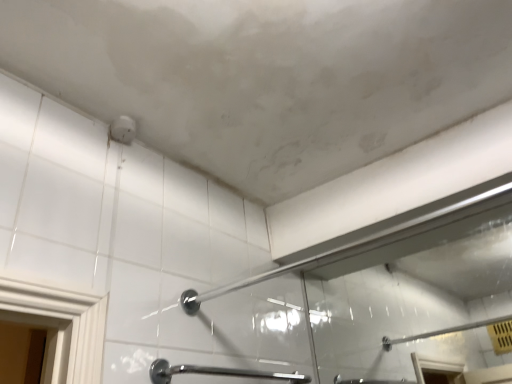
The width and height of the screenshot is (512, 384). I want to click on white glossy shower at center, so click(x=384, y=243).

The width and height of the screenshot is (512, 384). Describe the element at coordinates (384, 243) in the screenshot. I see `white glossy shower at center` at that location.

In order to face polished chrome grab bar at lower center, should I rotate leftwards or rightwards?

You should rotate left by 0.037 degrees.

Describe the element at coordinates (217, 373) in the screenshot. The width and height of the screenshot is (512, 384). I see `polished chrome grab bar at lower center` at that location.

Where is `polished chrome grab bar at lower center`? polished chrome grab bar at lower center is located at coordinates (217, 373).

Locate an element on the screen. The height and width of the screenshot is (384, 512). white glossy shower at center is located at coordinates (x=384, y=243).

Which object is positioned more to the left, white glossy shower at center or polished chrome grab bar at lower center?

Positioned to the left is polished chrome grab bar at lower center.

Which object is further away from the camera, white glossy shower at center or polished chrome grab bar at lower center?

polished chrome grab bar at lower center.

Considering the points (373, 243) and (157, 366), which point is behind, point (373, 243) or point (157, 366)?

The point (373, 243) is farther.

From the image's perspective, is white glossy shower at center on polished chrome grab bar at lower center?

Yes, from the image's perspective, white glossy shower at center is over polished chrome grab bar at lower center.

From a real-world perspective, is white glossy shower at center under polished chrome grab bar at lower center?

Incorrect, from a real-world perspective, white glossy shower at center is higher than polished chrome grab bar at lower center.

Looking at this image, between white glossy shower at center and polished chrome grab bar at lower center, which one has larger width?

With larger width is polished chrome grab bar at lower center.

Can you confirm if white glossy shower at center is taller than polished chrome grab bar at lower center?

No, white glossy shower at center is not taller than polished chrome grab bar at lower center.

In terms of size, does white glossy shower at center appear bigger or smaller than polished chrome grab bar at lower center?

Considering their sizes, white glossy shower at center takes up more space than polished chrome grab bar at lower center.

Is polished chrome grab bar at lower center surrounded by white glossy shower at center?

No, polished chrome grab bar at lower center is not a part of white glossy shower at center.

Is white glossy shower at center next to polished chrome grab bar at lower center and touching it?

No, white glossy shower at center is not touching polished chrome grab bar at lower center.

Could you tell me if white glossy shower at center is turned towards polished chrome grab bar at lower center?

No, white glossy shower at center is not turned towards polished chrome grab bar at lower center.

Measure the distance from white glossy shower at center to polished chrome grab bar at lower center.

The distance of white glossy shower at center from polished chrome grab bar at lower center is 56.32 centimeters.

The image size is (512, 384). Identify the location of shower lying on the right of polished chrome grab bar at lower center. (384, 243).

Which is more to the left, polished chrome grab bar at lower center or white glossy shower at center?

From the viewer's perspective, polished chrome grab bar at lower center appears more on the left side.

Which is in front, polished chrome grab bar at lower center or white glossy shower at center?

white glossy shower at center.

Considering the points (308, 380) and (440, 224), which point is in front, point (308, 380) or point (440, 224)?

Positioned in front is point (440, 224).

From the image's perspective, is polished chrome grab bar at lower center located above or below white glossy shower at center?

Based on their image positions, polished chrome grab bar at lower center is located beneath white glossy shower at center.

From a real-world perspective, is polished chrome grab bar at lower center on top of white glossy shower at center?

Actually, polished chrome grab bar at lower center is physically below white glossy shower at center in the real world.

Looking at their sizes, would you say polished chrome grab bar at lower center is wider or thinner than white glossy shower at center?

Clearly, polished chrome grab bar at lower center has more width compared to white glossy shower at center.

Based on the photo, considering the relative sizes of polished chrome grab bar at lower center and white glossy shower at center in the image provided, is polished chrome grab bar at lower center taller than white glossy shower at center?

Indeed, polished chrome grab bar at lower center has a greater height compared to white glossy shower at center.

Considering the sizes of objects polished chrome grab bar at lower center and white glossy shower at center in the image provided, who is smaller, polished chrome grab bar at lower center or white glossy shower at center?

polished chrome grab bar at lower center.

Is polished chrome grab bar at lower center inside the boundaries of white glossy shower at center, or outside?

polished chrome grab bar at lower center is not inside white glossy shower at center, it's outside.

Is polished chrome grab bar at lower center in contact with white glossy shower at center?

No, polished chrome grab bar at lower center is not next to white glossy shower at center.

Is white glossy shower at center at the back of polished chrome grab bar at lower center?

No, polished chrome grab bar at lower center's orientation is not away from white glossy shower at center.

The width and height of the screenshot is (512, 384). Identify the location of door handle behind the white glossy shower at center. (217, 373).

I want to click on shower that appears in front of the polished chrome grab bar at lower center, so click(384, 243).

Where is `door handle below the white glossy shower at center (from the image's perspective)`? The height and width of the screenshot is (384, 512). door handle below the white glossy shower at center (from the image's perspective) is located at coordinates (217, 373).